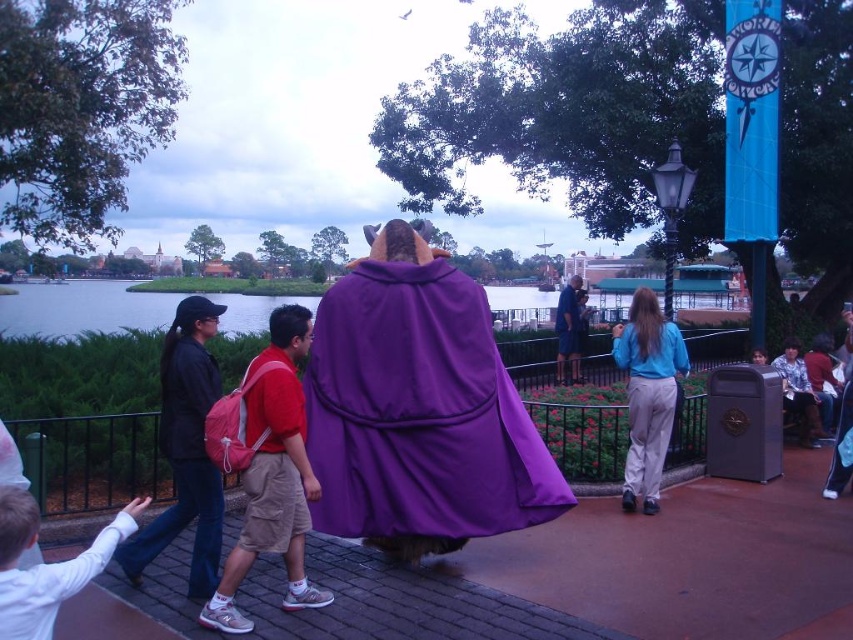
Question: Estimate the real-world distances between objects in this image. Which object is closer to the light blue fabric pants at center-right?

Choices:
 (A) red backpack at center
 (B) blue fabric coat at center
 (C) purple fleece cape at center

Answer: (C)

Question: Can you confirm if purple fleece cape at center is wider than light blue fabric pants at center-right?

Choices:
 (A) no
 (B) yes

Answer: (B)

Question: Which point is closer to the camera?

Choices:
 (A) (641, 330)
 (B) (270, 396)
 (C) (175, 436)
 (D) (564, 300)

Answer: (B)

Question: Considering the relative positions of black fabric backpack at left and light blue fabric pants at center-right in the image provided, where is black fabric backpack at left located with respect to light blue fabric pants at center-right?

Choices:
 (A) left
 (B) right

Answer: (A)

Question: Can you confirm if purple fleece cape at center is bigger than red backpack at center?

Choices:
 (A) no
 (B) yes

Answer: (B)

Question: Among these objects, which one is farthest from the camera?

Choices:
 (A) red backpack at center
 (B) blue fabric coat at center
 (C) black fabric backpack at left
 (D) light blue fabric pants at center-right

Answer: (B)